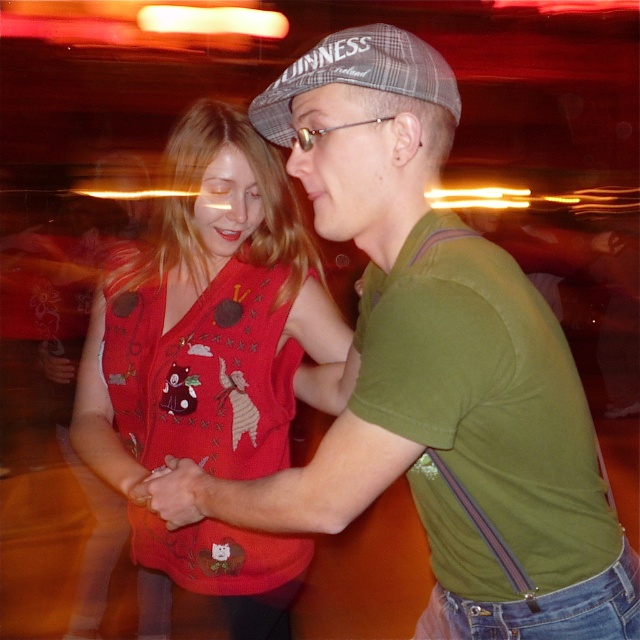
How far apart are matte red sweater vest at center and plaid fabric baseball cap at upper center?

matte red sweater vest at center is 21.84 inches from plaid fabric baseball cap at upper center.

Which of these two, matte red sweater vest at center or plaid fabric baseball cap at upper center, stands taller?

matte red sweater vest at center is taller.

Who is more distant from viewer, (188,426) or (394,74)?

Point (188,426)

What are the coordinates of `matte red sweater vest at center` in the screenshot? It's located at (209, 362).